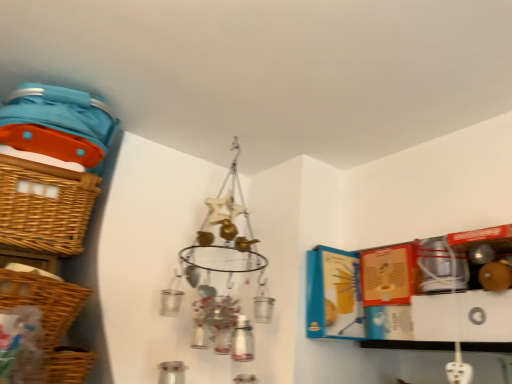
Describe the element at coordinates (44, 205) in the screenshot. I see `woven brown basket at left, which is the third basket from bottom to top` at that location.

In order to click on woven brown basket at left, which is the third basket from bottom to top in this screenshot , I will do `click(44, 205)`.

In the image, is woven brown basket at left, placed as the second basket when sorted from top to bottom, positioned in front of or behind woven brown basket at left, which is the third basket from bottom to top?

woven brown basket at left, placed as the second basket when sorted from top to bottom, is positioned closer to the viewer than woven brown basket at left, which is the third basket from bottom to top.

Is woven brown basket at left, placed as the second basket when sorted from top to bottom, inside or outside of woven brown basket at left, marked as the first basket in a top-to-bottom arrangement?

woven brown basket at left, placed as the second basket when sorted from top to bottom, is located beyond the bounds of woven brown basket at left, marked as the first basket in a top-to-bottom arrangement.

In the scene shown: Between woven brown basket at left, the second basket when ordered from bottom to top, and woven brown basket at left, which is the third basket from bottom to top, which one has more height?

woven brown basket at left, which is the third basket from bottom to top.

Is point (37, 217) less distant than point (57, 313)?

That is False.

Is woven brown basket at left, marked as the first basket in a top-to-bottom arrangement, facing towards woven brown basket at left, the second basket when ordered from bottom to top?

No, woven brown basket at left, marked as the first basket in a top-to-bottom arrangement, is not facing towards woven brown basket at left, the second basket when ordered from bottom to top.

From a real-world perspective, is woven brown basket at left, marked as the first basket in a top-to-bottom arrangement, under woven brown basket at left, placed as the second basket when sorted from top to bottom?

No.

In the scene shown: Considering the sizes of woven brown basket at left, marked as the first basket in a top-to-bottom arrangement, and woven brown basket at left, the second basket when ordered from bottom to top, in the image, is woven brown basket at left, marked as the first basket in a top-to-bottom arrangement, wider or thinner than woven brown basket at left, the second basket when ordered from bottom to top,?

Considering their sizes, woven brown basket at left, marked as the first basket in a top-to-bottom arrangement, looks broader than woven brown basket at left, the second basket when ordered from bottom to top.

Is woven brown basket at lower left, which is the 3th basket from top to bottom, located within woven brown basket at left, which is the third basket from bottom to top?

Definitely not — woven brown basket at lower left, which is the 3th basket from top to bottom, is not inside woven brown basket at left, which is the third basket from bottom to top.

Considering the sizes of objects woven brown basket at left, marked as the first basket in a top-to-bottom arrangement, and woven brown basket at lower left, the first basket in the bottom-to-top sequence, in the image provided, who is thinner, woven brown basket at left, marked as the first basket in a top-to-bottom arrangement, or woven brown basket at lower left, the first basket in the bottom-to-top sequence,?

With smaller width is woven brown basket at lower left, the first basket in the bottom-to-top sequence.

In the scene shown: Is woven brown basket at left, which is the third basket from bottom to top, next to woven brown basket at lower left, which is the 3th basket from top to bottom, and touching it?

woven brown basket at left, which is the third basket from bottom to top, and woven brown basket at lower left, which is the 3th basket from top to bottom, are clearly separated.

At what (x,y) coordinates should I click in order to perform the action: click on basket that is the 2nd one when counting downward from the woven brown basket at left, which is the third basket from bottom to top (from the image's perspective). Please return your answer as a coordinate pair (x, y). Looking at the image, I should click on (68, 366).

Considering the relative sizes of woven brown basket at left, placed as the second basket when sorted from top to bottom, and woven brown basket at lower left, which is the 3th basket from top to bottom, in the image provided, is woven brown basket at left, placed as the second basket when sorted from top to bottom, smaller than woven brown basket at lower left, which is the 3th basket from top to bottom,?

Actually, woven brown basket at left, placed as the second basket when sorted from top to bottom, might be larger than woven brown basket at lower left, which is the 3th basket from top to bottom.

Is woven brown basket at left, placed as the second basket when sorted from top to bottom, positioned behind woven brown basket at lower left, the first basket in the bottom-to-top sequence?

No, the depth of woven brown basket at left, placed as the second basket when sorted from top to bottom, is less than that of woven brown basket at lower left, the first basket in the bottom-to-top sequence.

From the image's perspective, does woven brown basket at left, placed as the second basket when sorted from top to bottom, appear lower than woven brown basket at lower left, the first basket in the bottom-to-top sequence?

Incorrect, from the image's perspective, woven brown basket at left, placed as the second basket when sorted from top to bottom, is higher than woven brown basket at lower left, the first basket in the bottom-to-top sequence.

From the image's perspective, would you say woven brown basket at lower left, which is the 3th basket from top to bottom, is shown under woven brown basket at left, which is the third basket from bottom to top?

Yes, from the image's perspective, woven brown basket at lower left, which is the 3th basket from top to bottom, is beneath woven brown basket at left, which is the third basket from bottom to top.

Looking at this image, would you say woven brown basket at lower left, which is the 3th basket from top to bottom, contains woven brown basket at left, which is the third basket from bottom to top?

No, woven brown basket at left, which is the third basket from bottom to top, is not inside woven brown basket at lower left, which is the 3th basket from top to bottom.

Does woven brown basket at lower left, the first basket in the bottom-to-top sequence, come behind woven brown basket at left, which is the third basket from bottom to top?

No, woven brown basket at lower left, the first basket in the bottom-to-top sequence, is closer to the camera.

Is woven brown basket at lower left, the first basket in the bottom-to-top sequence, turned away from woven brown basket at left, which is the third basket from bottom to top?

No, woven brown basket at lower left, the first basket in the bottom-to-top sequence, is not facing the opposite direction of woven brown basket at left, which is the third basket from bottom to top.

Is woven brown basket at lower left, which is the 3th basket from top to bottom, far away from woven brown basket at left, placed as the second basket when sorted from top to bottom?

woven brown basket at lower left, which is the 3th basket from top to bottom, is actually quite close to woven brown basket at left, placed as the second basket when sorted from top to bottom.

Do you think woven brown basket at lower left, the first basket in the bottom-to-top sequence, is within woven brown basket at left, placed as the second basket when sorted from top to bottom, or outside of it?

woven brown basket at lower left, the first basket in the bottom-to-top sequence, is outside woven brown basket at left, placed as the second basket when sorted from top to bottom.

This screenshot has width=512, height=384. I want to click on basket that is the 1st one when counting leftward from the woven brown basket at lower left, which is the 3th basket from top to bottom, so click(44, 301).

Considering the sizes of woven brown basket at lower left, the first basket in the bottom-to-top sequence, and woven brown basket at left, placed as the second basket when sorted from top to bottom, in the image, is woven brown basket at lower left, the first basket in the bottom-to-top sequence, taller or shorter than woven brown basket at left, placed as the second basket when sorted from top to bottom,?

Clearly, woven brown basket at lower left, the first basket in the bottom-to-top sequence, is shorter compared to woven brown basket at left, placed as the second basket when sorted from top to bottom.

At what (x,y) coordinates should I click in order to perform the action: click on basket lying above the woven brown basket at left, the second basket when ordered from bottom to top (from the image's perspective). Please return your answer as a coordinate pair (x, y). The image size is (512, 384). Looking at the image, I should click on (44, 205).

You are a GUI agent. You are given a task and a screenshot of the screen. Output one action in this format:
    pyautogui.click(x=<x>, y=<y>)
    Task: Click on the 1st basket positioned below the woven brown basket at left, which is the third basket from bottom to top (from a real-world perspective)
    The height and width of the screenshot is (384, 512).
    Given the screenshot: What is the action you would take?
    pyautogui.click(x=44, y=301)

Consider the image. From the image, which object appears to be nearer to woven brown basket at left, which is the third basket from bottom to top, woven brown basket at left, the second basket when ordered from bottom to top, or woven brown basket at lower left, which is the 3th basket from top to bottom?

Among the two, woven brown basket at left, the second basket when ordered from bottom to top, is located nearer to woven brown basket at left, which is the third basket from bottom to top.

Which object lies further to the anchor point woven brown basket at left, placed as the second basket when sorted from top to bottom, woven brown basket at lower left, the first basket in the bottom-to-top sequence, or woven brown basket at left, marked as the first basket in a top-to-bottom arrangement?

The object further to woven brown basket at left, placed as the second basket when sorted from top to bottom, is woven brown basket at left, marked as the first basket in a top-to-bottom arrangement.

From the image, which object appears to be farther from woven brown basket at lower left, which is the 3th basket from top to bottom, woven brown basket at left, placed as the second basket when sorted from top to bottom, or woven brown basket at left, which is the third basket from bottom to top?

woven brown basket at left, which is the third basket from bottom to top, is positioned further to the anchor woven brown basket at lower left, which is the 3th basket from top to bottom.

Based on their spatial positions, is woven brown basket at lower left, the first basket in the bottom-to-top sequence, or woven brown basket at left, placed as the second basket when sorted from top to bottom, further from woven brown basket at left, marked as the first basket in a top-to-bottom arrangement?

The object further to woven brown basket at left, marked as the first basket in a top-to-bottom arrangement, is woven brown basket at lower left, the first basket in the bottom-to-top sequence.

Considering their positions, is woven brown basket at left, which is the third basket from bottom to top, positioned closer to woven brown basket at lower left, the first basket in the bottom-to-top sequence, than woven brown basket at left, the second basket when ordered from bottom to top?

woven brown basket at left, the second basket when ordered from bottom to top, is closer to woven brown basket at lower left, the first basket in the bottom-to-top sequence.

Which object lies nearer to the anchor point woven brown basket at left, the second basket when ordered from bottom to top, woven brown basket at left, marked as the first basket in a top-to-bottom arrangement, or woven brown basket at lower left, which is the 3th basket from top to bottom?

woven brown basket at lower left, which is the 3th basket from top to bottom, lies closer to woven brown basket at left, the second basket when ordered from bottom to top, than the other object.

The height and width of the screenshot is (384, 512). What are the coordinates of `basket between woven brown basket at left, which is the third basket from bottom to top, and woven brown basket at lower left, which is the 3th basket from top to bottom, vertically` in the screenshot? It's located at (44, 301).